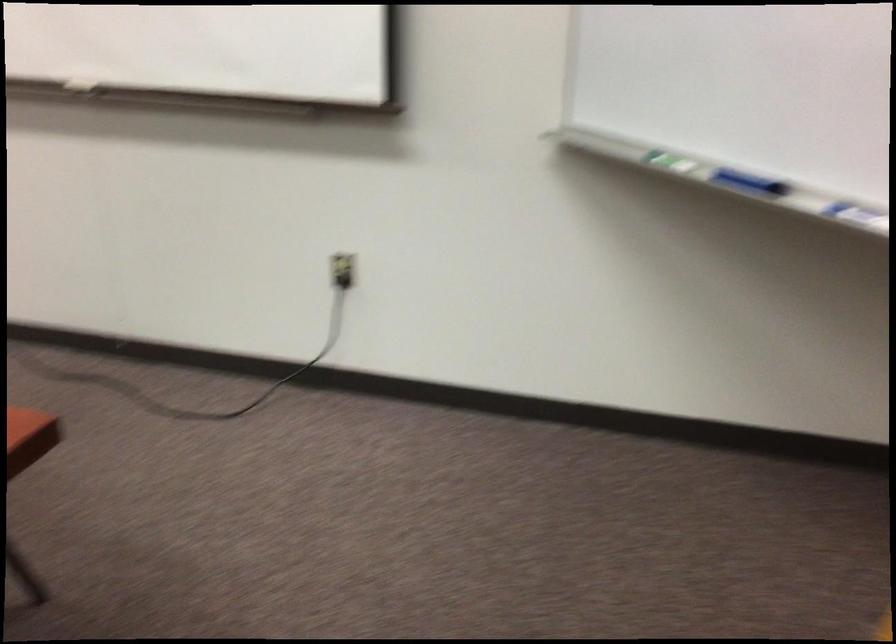
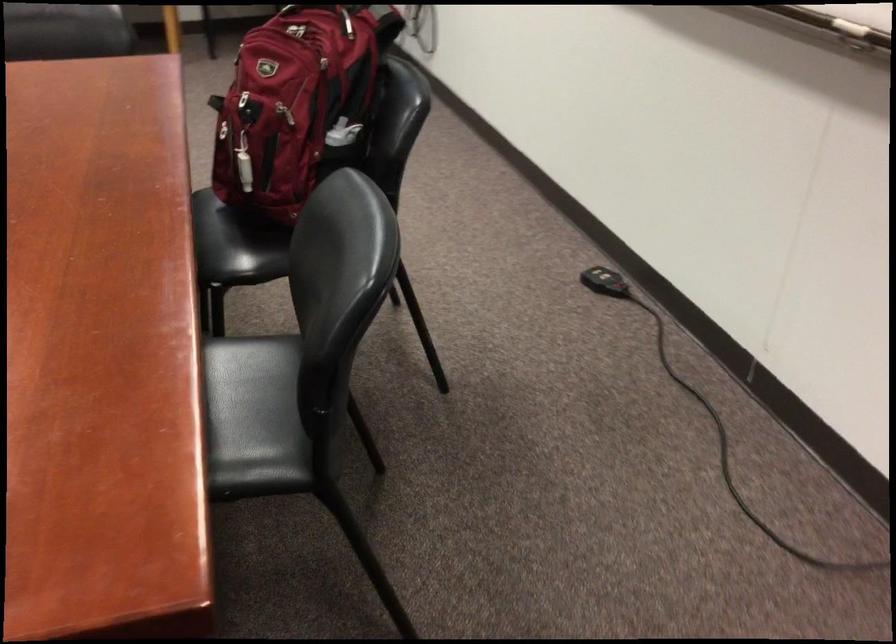
Based on the continuous images, in which direction is the camera rotating?

The camera's rotation is toward left-down.